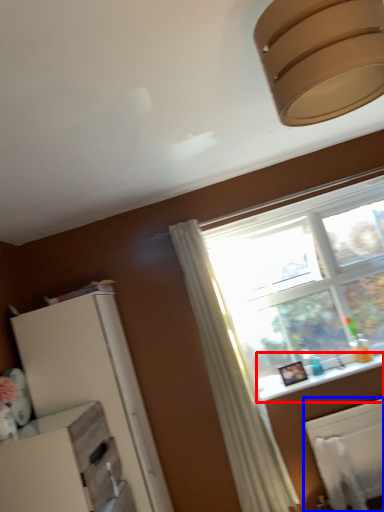
Question: Which of the following is the closest to the observer, window sill (highlighted by a red box) or radiator (highlighted by a blue box)?

Choices:
 (A) window sill
 (B) radiator

Answer: (B)